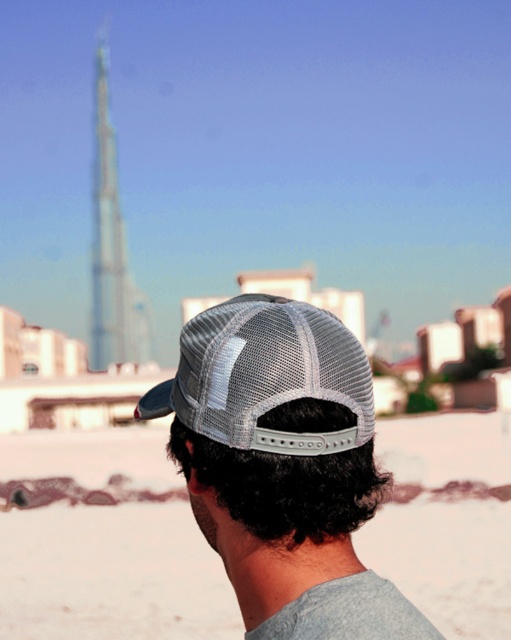
Question: Does white sand at lower center appear under gray mesh baseball cap at center?

Choices:
 (A) no
 (B) yes

Answer: (B)

Question: Which of the following is the farthest from the observer?

Choices:
 (A) (300, 433)
 (B) (421, 433)
 (C) (256, 536)

Answer: (B)

Question: Does white sand at lower center appear over gray mesh baseball cap at center?

Choices:
 (A) yes
 (B) no

Answer: (B)

Question: Among these points, which one is nearest to the camera?

Choices:
 (A) (105, 163)
 (B) (245, 371)

Answer: (B)

Question: Among these objects, which one is farthest from the camera?

Choices:
 (A) transparent glass tower at upper center
 (B) gray mesh cap at center
 (C) white sand at lower center

Answer: (A)

Question: Does white sand at lower center have a greater width compared to gray mesh baseball cap at center?

Choices:
 (A) no
 (B) yes

Answer: (B)